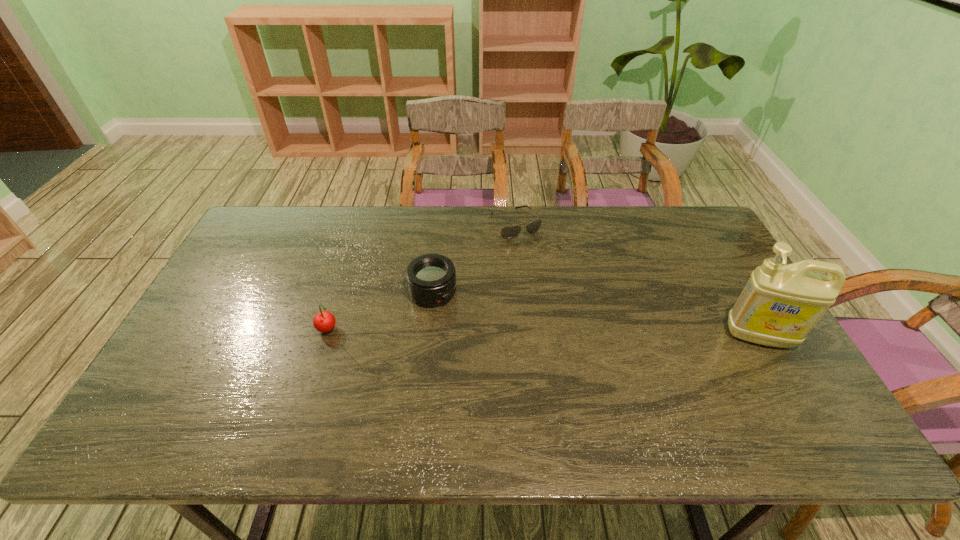
The image size is (960, 540). I want to click on the leftmost object, so click(x=324, y=321).

Locate an element on the screen. The image size is (960, 540). cherry is located at coordinates (324, 321).

I want to click on the tallest object, so click(778, 307).

At what (x,y) coordinates should I click in order to perform the action: click on detergent. Please return your answer as a coordinate pair (x, y). Image resolution: width=960 pixels, height=540 pixels. Looking at the image, I should click on (778, 307).

Locate an element on the screen. The image size is (960, 540). sunglasses is located at coordinates (509, 232).

The image size is (960, 540). Find the location of `the third object from left to right`. the third object from left to right is located at coordinates (509, 232).

Where is `the second object from left to right`? This screenshot has height=540, width=960. the second object from left to right is located at coordinates (431, 278).

Identify the location of telephoto lens. The image size is (960, 540). (431, 278).

Where is `free spot located 0.080m on the left of the leftmost object`? free spot located 0.080m on the left of the leftmost object is located at coordinates (287, 330).

Identify the location of free spot located on the back of the tallest object. (729, 285).